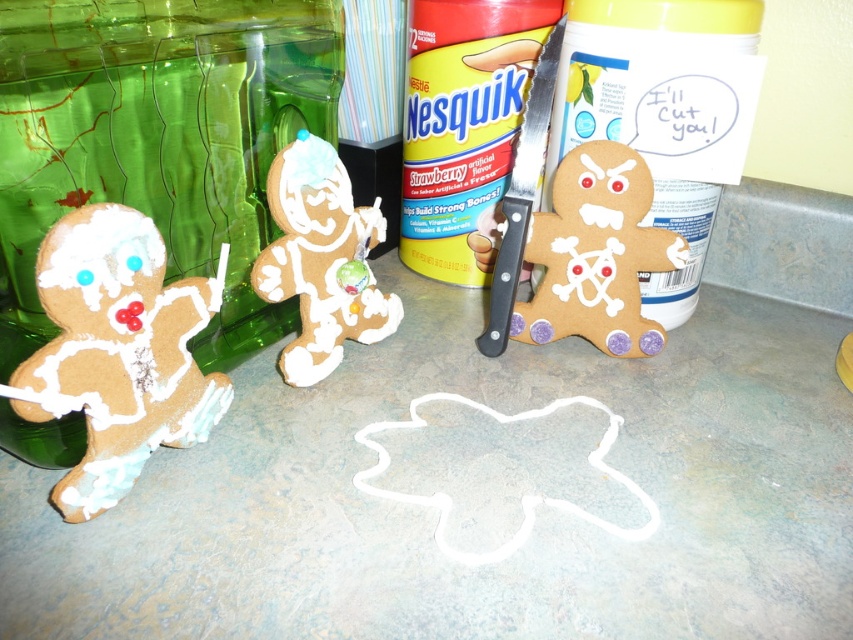
Between white sugar-coated gingerbread man at left and white frosted gingerbread man at center, which one appears on the right side from the viewer's perspective?

Positioned to the right is white frosted gingerbread man at center.

Based on the photo, between white sugar-coated gingerbread man at left and white frosted gingerbread man at center, which one has more height?

white frosted gingerbread man at center

Is point (64, 388) closer to viewer compared to point (299, 257)?

Yes, point (64, 388) is in front of point (299, 257).

This screenshot has height=640, width=853. Identify the location of white sugar-coated gingerbread man at left. (117, 352).

Is brown cardboard gingerbread man at center right shorter than white frosted gingerbread man at center?

Indeed, brown cardboard gingerbread man at center right has a lesser height compared to white frosted gingerbread man at center.

Who is more forward, (560,275) or (267,182)?

Point (267,182) is more forward.

Between point (509, 216) and point (360, 330), which one is positioned behind?

The point (360, 330) is behind.

You are a GUI agent. You are given a task and a screenshot of the screen. Output one action in this format:
    pyautogui.click(x=<x>, y=<y>)
    Task: Click on the brown cardboard gingerbread man at center right
    The image size is (853, 640).
    Given the screenshot: What is the action you would take?
    pyautogui.click(x=583, y=257)

Between point (137, 406) and point (583, 196), which one is positioned behind?

Positioned behind is point (583, 196).

Looking at this image, is white sugar-coated gingerbread man at left shorter than brown cardboard gingerbread man at center right?

Yes.

Which is in front, point (67, 352) or point (647, 266)?

Point (67, 352) is more forward.

You are a GUI agent. You are given a task and a screenshot of the screen. Output one action in this format:
    pyautogui.click(x=<x>, y=<y>)
    Task: Click on the white sugar-coated gingerbread man at left
    
    Given the screenshot: What is the action you would take?
    pyautogui.click(x=117, y=352)